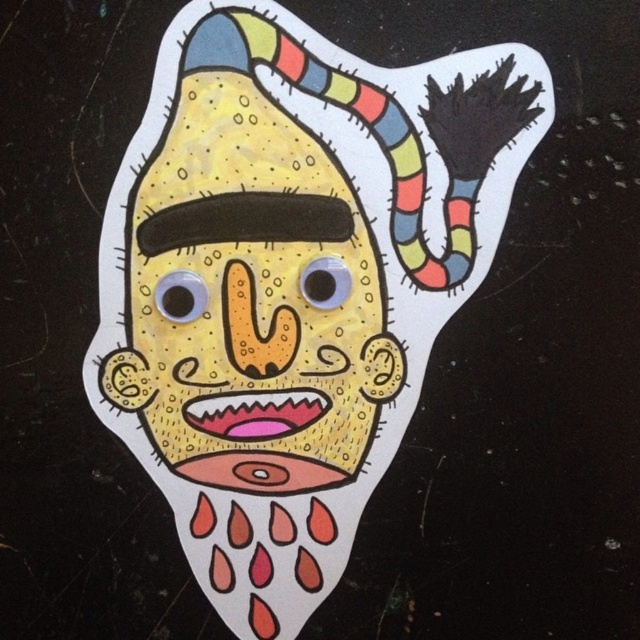
Can you confirm if matte yellow mask at center is thinner than yellow textured face at center?

Incorrect, matte yellow mask at center's width is not less than yellow textured face at center's.

Which is below, matte yellow mask at center or yellow textured face at center?

matte yellow mask at center is below.

Is point (276, 483) in front of point (240, 108)?

That is False.

The image size is (640, 640). Identify the location of matte yellow mask at center. (292, 282).